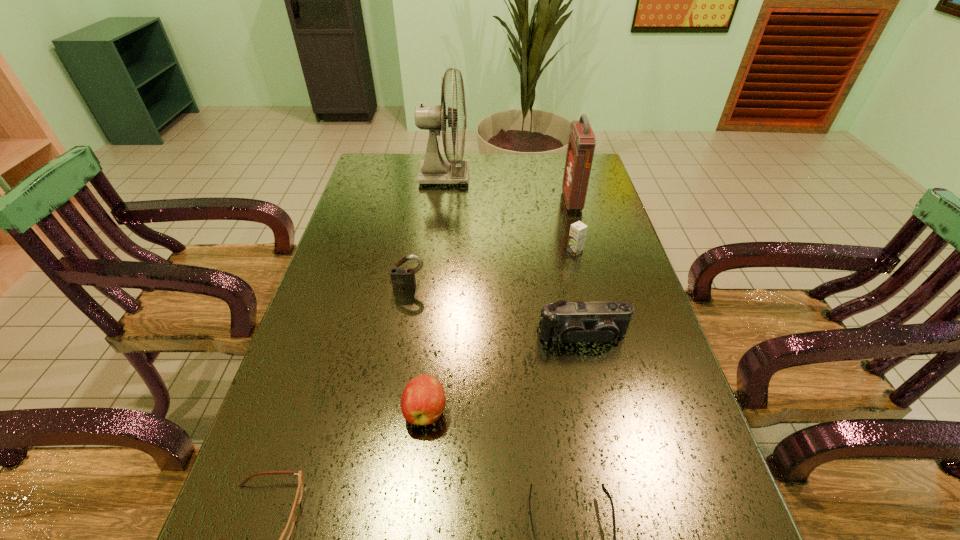
Find the location of a particular element. This screenshot has width=960, height=540. vacant region located with the keyhole on the front of the fifth nearest object is located at coordinates (405, 316).

At what (x,y) coordinates should I click in order to perform the action: click on blank area located on the front-facing side of the fourth nearest object. Please return your answer as a coordinate pair (x, y). The image size is (960, 540). Looking at the image, I should click on (609, 458).

The image size is (960, 540). Identify the location of free space located 0.240m on the left of the chocolate milk. point(485,252).

Locate an element on the screen. The width and height of the screenshot is (960, 540). vacant space situated on the back of the apple is located at coordinates (433, 336).

Locate an element on the screen. object present at the far edge is located at coordinates (434, 169).

The width and height of the screenshot is (960, 540). I want to click on the first-aid kit that is at the right edge, so click(581, 145).

Locate an element on the screen. camcorder present at the right edge is located at coordinates (603, 322).

You are a GUI agent. You are given a task and a screenshot of the screen. Output one action in this format:
    pyautogui.click(x=<x>, y=<y>)
    Task: Click on the chocolate milk that is at the right edge
    This screenshot has height=540, width=960.
    Given the screenshot: What is the action you would take?
    pyautogui.click(x=578, y=230)

In the image, there is a desktop. Identify the location of vacant space at the far edge. (420, 157).

This screenshot has height=540, width=960. Identify the location of vacant space at the left edge of the desktop. (320, 330).